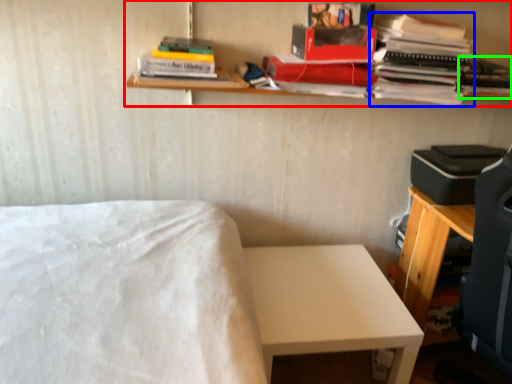
Question: Considering the real-world distances, which object is closest to shelf (highlighted by a red box)? book (highlighted by a blue box) or book (highlighted by a green box).

Choices:
 (A) book
 (B) book

Answer: (B)